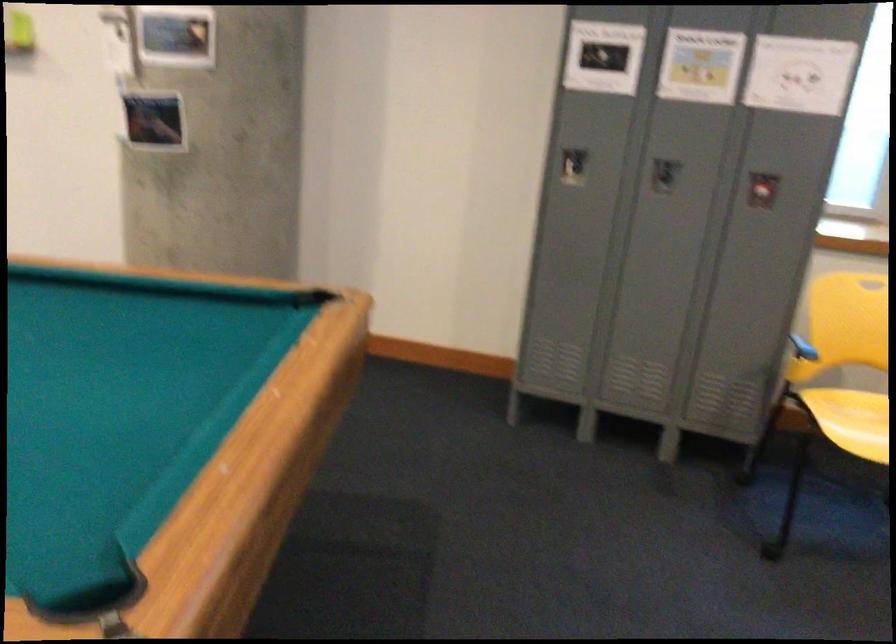
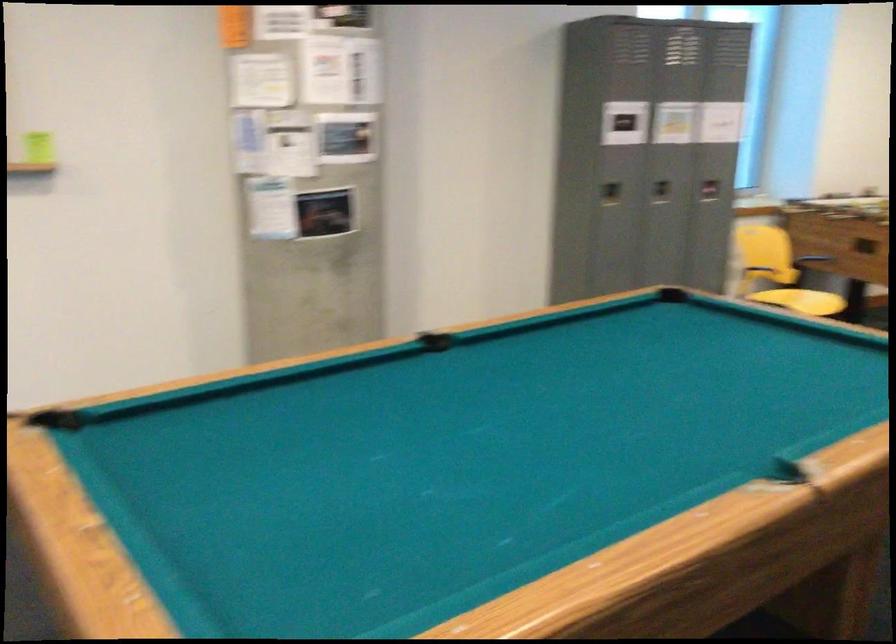
Find the pixel in the second image that matches point 728,192 in the first image.

(710, 190)